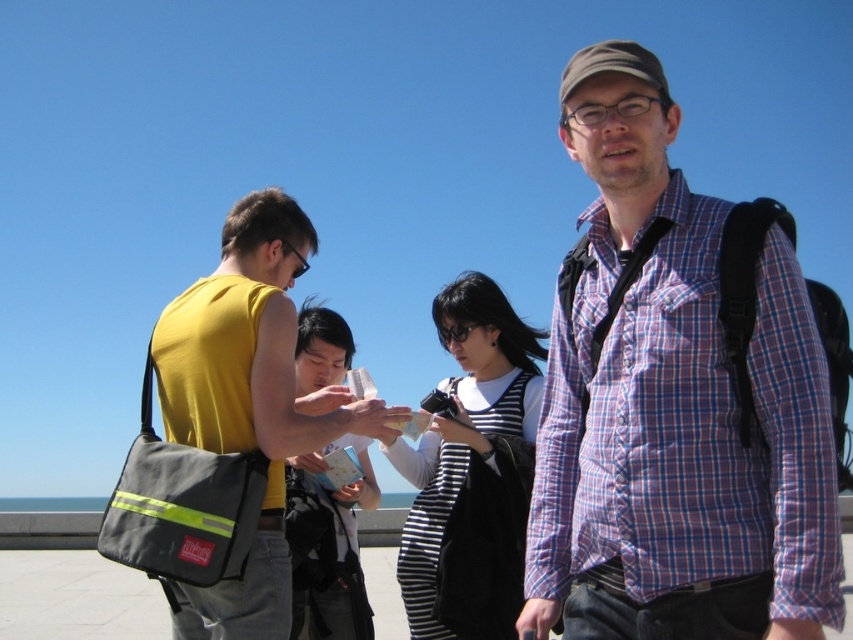
Question: Can you confirm if yellow fabric tank top at left is positioned above striped fabric dress at center?

Choices:
 (A) no
 (B) yes

Answer: (A)

Question: Can you confirm if striped fabric dress at center is thinner than striped fabric shirt at center?

Choices:
 (A) no
 (B) yes

Answer: (A)

Question: Which object is farther from the camera taking this photo?

Choices:
 (A) striped fabric shirt at center
 (B) yellow fabric tank top at left
 (C) striped fabric dress at center

Answer: (C)

Question: Among these objects, which one is nearest to the camera?

Choices:
 (A) striped fabric shirt at center
 (B) striped fabric dress at center

Answer: (A)

Question: Does yellow fabric tank top at left appear on the left side of striped fabric shirt at center?

Choices:
 (A) yes
 (B) no

Answer: (A)

Question: Which object is positioned closest to the striped fabric shirt at center?

Choices:
 (A) yellow fabric tank top at left
 (B) plaid cotton shirt at center

Answer: (A)